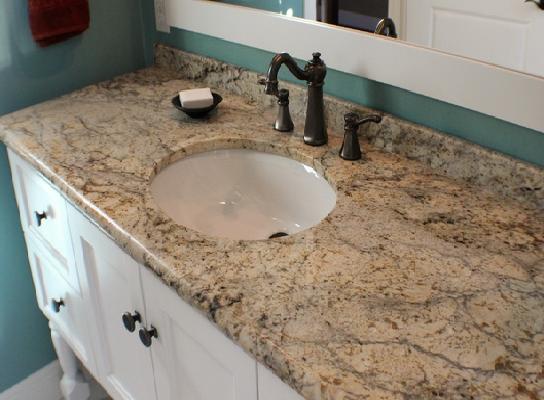
At what (x,y) coordinates should I click in order to perform the action: click on sink. Please return your answer as a coordinate pair (x, y). Looking at the image, I should click on (228, 196).